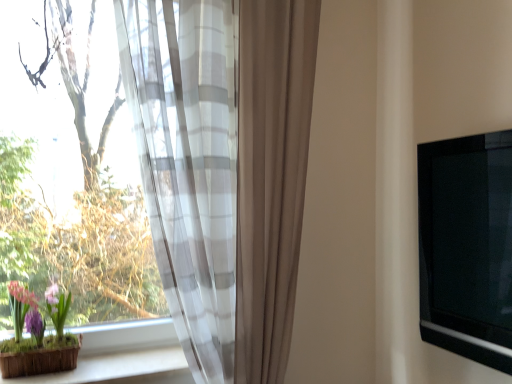
In order to face wooden at lower left, should I rotate leftwards or rightwards?

It's best to rotate left around 20.115 degrees.

This screenshot has height=384, width=512. Describe the element at coordinates (122, 166) in the screenshot. I see `transparent fabric at left` at that location.

Identify the location of matte brown pot at lower left. (40, 337).

Where is `sheer white and gray striped curtain at left`? sheer white and gray striped curtain at left is located at coordinates (224, 168).

You are a GUI agent. You are given a task and a screenshot of the screen. Output one action in this format:
    pyautogui.click(x=<x>, y=<y>)
    Task: Click on the wooden at lower left
    
    Given the screenshot: What is the action you would take?
    pyautogui.click(x=119, y=353)

How different are the orientations of wooden at lower left and sheer white and gray striped curtain at left in degrees?

They differ by 0.000306 degrees in their facing directions.

Could you tell me if wooden at lower left is facing sheer white and gray striped curtain at left?

Yes, wooden at lower left is oriented towards sheer white and gray striped curtain at left.

Can you confirm if wooden at lower left is positioned to the right of sheer white and gray striped curtain at left?

No.

Between point (175, 366) and point (307, 48), which one is positioned in front?

Positioned in front is point (175, 366).

Is transparent fabric at left in front of or behind wooden at lower left in the image?

Visually, transparent fabric at left is located in front of wooden at lower left.

From a real-world perspective, relative to wooden at lower left, is transparent fabric at left vertically above or below?

transparent fabric at left is situated higher than wooden at lower left in the real world.

From the image's perspective, is transparent fabric at left located above or below wooden at lower left?

From the image's perspective, transparent fabric at left appears above wooden at lower left.

Is black glossy tv at right wider than sheer white and gray striped curtain at left?

In fact, black glossy tv at right might be narrower than sheer white and gray striped curtain at left.

Is sheer white and gray striped curtain at left at the back of black glossy tv at right?

No, sheer white and gray striped curtain at left is not at the back of black glossy tv at right.

Can you tell me how much black glossy tv at right and sheer white and gray striped curtain at left differ in facing direction?

90 degrees.

Consider the image. Is black glossy tv at right not inside sheer white and gray striped curtain at left?

Yes, black glossy tv at right is located beyond the bounds of sheer white and gray striped curtain at left.

Between black glossy tv at right and wooden at lower left, which one is positioned behind?

wooden at lower left is more distant.

Considering the positions of points (479, 339) and (114, 326), is point (479, 339) closer to camera compared to point (114, 326)?

Yes, point (479, 339) is closer to viewer.

I want to click on window screen on the right of wooden at lower left, so click(x=467, y=246).

Are black glossy tv at right and wooden at lower left making contact?

black glossy tv at right is not next to wooden at lower left, and they're not touching.

Which is more to the left, black glossy tv at right or matte brown pot at lower left?

From the viewer's perspective, matte brown pot at lower left appears more on the left side.

Is the surface of black glossy tv at right in direct contact with matte brown pot at lower left?

No.

Is black glossy tv at right bigger than matte brown pot at lower left?

Indeed, black glossy tv at right has a larger size compared to matte brown pot at lower left.

Are transparent fabric at left and black glossy tv at right beside each other?

No, transparent fabric at left is not beside black glossy tv at right.

Find the location of `window that appears above the black glossy tv at right (from the image's perspective)`. window that appears above the black glossy tv at right (from the image's perspective) is located at coordinates 122,166.

Does point (230, 276) come closer to viewer compared to point (446, 245)?

Yes.

Between transparent fabric at left and black glossy tv at right, which one has more height?

With more height is transparent fabric at left.

From a real-world perspective, which object rests below the other?

In real-world perspective, wooden at lower left is lower.

Measure the distance between wooden at lower left and black glossy tv at right.

wooden at lower left is 3.88 feet away from black glossy tv at right.

From the picture: Considering the sizes of objects wooden at lower left and black glossy tv at right in the image provided, who is taller, wooden at lower left or black glossy tv at right?

With more height is black glossy tv at right.

You are a GUI agent. You are given a task and a screenshot of the screen. Output one action in this format:
    pyautogui.click(x=<x>, y=<y>)
    Task: Click on the window sill below the sheer white and gray striped curtain at left (from the image's perspective)
    The width and height of the screenshot is (512, 384).
    Given the screenshot: What is the action you would take?
    pyautogui.click(x=119, y=353)

Where is `window above the wooden at lower left (from a real-world perspective)`? The image size is (512, 384). window above the wooden at lower left (from a real-world perspective) is located at coordinates (122, 166).

When comparing their distances from black glossy tv at right, does wooden at lower left or sheer white and gray striped curtain at left seem closer?

Among the two, sheer white and gray striped curtain at left is located nearer to black glossy tv at right.

When comparing their distances from black glossy tv at right, does transparent fabric at left or matte brown pot at lower left seem further?

matte brown pot at lower left lies further to black glossy tv at right than the other object.

Based on their spatial positions, is wooden at lower left or matte brown pot at lower left closer to transparent fabric at left?

Based on the image, matte brown pot at lower left appears to be nearer to transparent fabric at left.

Which object lies further to the anchor point black glossy tv at right, wooden at lower left or matte brown pot at lower left?

matte brown pot at lower left lies further to black glossy tv at right than the other object.

Looking at the image, which one is located further to wooden at lower left, black glossy tv at right or transparent fabric at left?

Among the two, black glossy tv at right is located further to wooden at lower left.

From the image, which object appears to be farther from black glossy tv at right, sheer white and gray striped curtain at left or wooden at lower left?

The object further to black glossy tv at right is wooden at lower left.

When comparing their distances from transparent fabric at left, does sheer white and gray striped curtain at left or wooden at lower left seem closer?

Based on the image, sheer white and gray striped curtain at left appears to be nearer to transparent fabric at left.

Which object lies further to the anchor point matte brown pot at lower left, transparent fabric at left or wooden at lower left?

transparent fabric at left lies further to matte brown pot at lower left than the other object.

Identify the location of window sill situated between matte brown pot at lower left and black glossy tv at right from left to right. (119, 353).

Image resolution: width=512 pixels, height=384 pixels. Identify the location of curtain that lies between transparent fabric at left and wooden at lower left from top to bottom. (224, 168).

Where is `houseplant between transparent fabric at left and wooden at lower left vertically`? This screenshot has height=384, width=512. houseplant between transparent fabric at left and wooden at lower left vertically is located at coordinates (40, 337).

What are the coordinates of `curtain between matte brown pot at lower left and black glossy tv at right from left to right` in the screenshot? It's located at (224, 168).